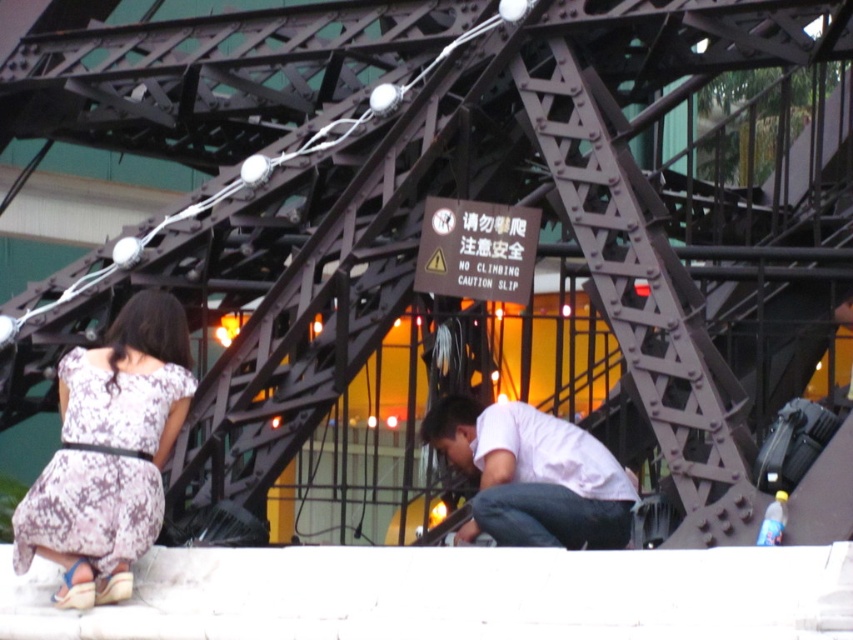
The height and width of the screenshot is (640, 853). What do you see at coordinates (102, 467) in the screenshot?
I see `floral print fabric dress at lower left` at bounding box center [102, 467].

Is floral print fabric dress at lower left positioned at the back of white matte shirt at lower center?

No, floral print fabric dress at lower left is closer to the viewer.

At what (x,y) coordinates should I click in order to perform the action: click on floral print fabric dress at lower left. Please return your answer as a coordinate pair (x, y). The image size is (853, 640). Looking at the image, I should click on (102, 467).